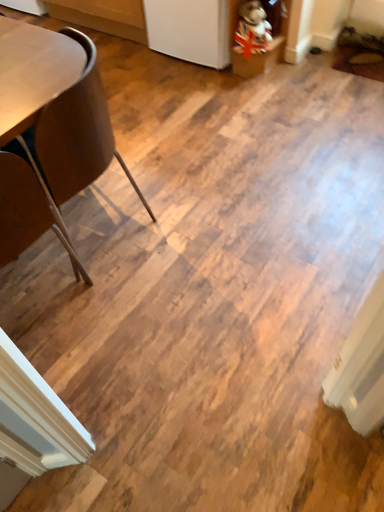
Find the location of a particular element. The image size is (384, 512). free spot behind brown leather chair at left, positioned as the 2th chair in bottom-to-top order is located at coordinates coord(142,160).